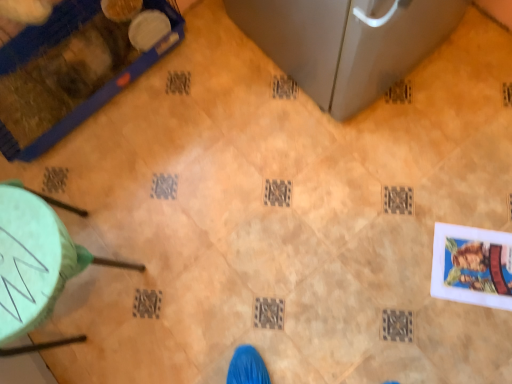
This screenshot has height=384, width=512. Find the location of `green plastic stool at lower left, the 2th furniture in the top-to-bottom sequence`. green plastic stool at lower left, the 2th furniture in the top-to-bottom sequence is located at coordinates (35, 260).

This screenshot has height=384, width=512. What do you see at coordinates (35, 260) in the screenshot?
I see `green plastic stool at lower left, placed as the first furniture when sorted from bottom to top` at bounding box center [35, 260].

What is the approximate height of green plastic stool at lower left, placed as the first furniture when sorted from bottom to top?

green plastic stool at lower left, placed as the first furniture when sorted from bottom to top, is 17.77 inches tall.

Identify the location of blue plastic pet cage at upper left, which is the 2th furniture in bottom-to-top order. The image size is (512, 384). (69, 72).

Image resolution: width=512 pixels, height=384 pixels. What do you see at coordinates (69, 72) in the screenshot? I see `blue plastic pet cage at upper left, which is the 2th furniture in bottom-to-top order` at bounding box center [69, 72].

You are a GUI agent. You are given a task and a screenshot of the screen. Output one action in this format:
    pyautogui.click(x=<x>, y=<y>)
    Task: Click on the green plastic stool at lower left, placed as the first furniture when sorted from bottom to top
    
    Given the screenshot: What is the action you would take?
    pyautogui.click(x=35, y=260)

Visually, is blue plastic pet cage at upper left, which appears as the first furniture when viewed from the top, positioned to the left or to the right of green plastic stool at lower left, the 2th furniture in the top-to-bottom sequence?

blue plastic pet cage at upper left, which appears as the first furniture when viewed from the top, is to the left of green plastic stool at lower left, the 2th furniture in the top-to-bottom sequence.

Which object is closer to the camera, blue plastic pet cage at upper left, which appears as the first furniture when viewed from the top, or green plastic stool at lower left, placed as the first furniture when sorted from bottom to top?

green plastic stool at lower left, placed as the first furniture when sorted from bottom to top, is more forward.

Which point is more forward, (94, 9) or (128, 267)?

Positioned in front is point (128, 267).

From the image's perspective, is blue plastic pet cage at upper left, which appears as the first furniture when viewed from the top, below green plastic stool at lower left, the 2th furniture in the top-to-bottom sequence?

No, from the image's perspective, blue plastic pet cage at upper left, which appears as the first furniture when viewed from the top, is not beneath green plastic stool at lower left, the 2th furniture in the top-to-bottom sequence.

From a real-world perspective, who is located lower, blue plastic pet cage at upper left, which is the 2th furniture in bottom-to-top order, or green plastic stool at lower left, the 2th furniture in the top-to-bottom sequence?

blue plastic pet cage at upper left, which is the 2th furniture in bottom-to-top order, is physically lower.

From the picture: In terms of width, does blue plastic pet cage at upper left, which appears as the first furniture when viewed from the top, look wider or thinner when compared to green plastic stool at lower left, the 2th furniture in the top-to-bottom sequence?

Clearly, blue plastic pet cage at upper left, which appears as the first furniture when viewed from the top, has more width compared to green plastic stool at lower left, the 2th furniture in the top-to-bottom sequence.

Between blue plastic pet cage at upper left, which is the 2th furniture in bottom-to-top order, and green plastic stool at lower left, the 2th furniture in the top-to-bottom sequence, which one has more height?

Standing taller between the two is green plastic stool at lower left, the 2th furniture in the top-to-bottom sequence.

Based on their sizes in the image, would you say blue plastic pet cage at upper left, which appears as the first furniture when viewed from the top, is bigger or smaller than green plastic stool at lower left, the 2th furniture in the top-to-bottom sequence?

blue plastic pet cage at upper left, which appears as the first furniture when viewed from the top, is bigger than green plastic stool at lower left, the 2th furniture in the top-to-bottom sequence.

Is blue plastic pet cage at upper left, which is the 2th furniture in bottom-to-top order, not within green plastic stool at lower left, the 2th furniture in the top-to-bottom sequence?

Indeed, blue plastic pet cage at upper left, which is the 2th furniture in bottom-to-top order, is completely outside green plastic stool at lower left, the 2th furniture in the top-to-bottom sequence.

Is blue plastic pet cage at upper left, which is the 2th furniture in bottom-to-top order, not near green plastic stool at lower left, placed as the first furniture when sorted from bottom to top?

blue plastic pet cage at upper left, which is the 2th furniture in bottom-to-top order, is actually quite close to green plastic stool at lower left, placed as the first furniture when sorted from bottom to top.

Consider the image. Could you tell me if blue plastic pet cage at upper left, which is the 2th furniture in bottom-to-top order, is facing green plastic stool at lower left, the 2th furniture in the top-to-bottom sequence?

Yes, blue plastic pet cage at upper left, which is the 2th furniture in bottom-to-top order, is turned towards green plastic stool at lower left, the 2th furniture in the top-to-bottom sequence.

Identify the location of furniture below the blue plastic pet cage at upper left, which appears as the first furniture when viewed from the top (from the image's perspective). (35, 260).

Does green plastic stool at lower left, the 2th furniture in the top-to-bottom sequence, appear on the left side of blue plastic pet cage at upper left, which appears as the first furniture when viewed from the top?

In fact, green plastic stool at lower left, the 2th furniture in the top-to-bottom sequence, is to the right of blue plastic pet cage at upper left, which appears as the first furniture when viewed from the top.

Is green plastic stool at lower left, the 2th furniture in the top-to-bottom sequence, closer to the viewer compared to blue plastic pet cage at upper left, which appears as the first furniture when viewed from the top?

Yes, it is.

Does point (24, 300) come in front of point (87, 82)?

Yes, it is.

From the image's perspective, which is below, green plastic stool at lower left, the 2th furniture in the top-to-bottom sequence, or blue plastic pet cage at upper left, which appears as the first furniture when viewed from the top?

From the image's view, green plastic stool at lower left, the 2th furniture in the top-to-bottom sequence, is below.

From a real-world perspective, is green plastic stool at lower left, placed as the first furniture when sorted from bottom to top, positioned over blue plastic pet cage at upper left, which appears as the first furniture when viewed from the top, based on gravity?

Indeed, from a real-world perspective, green plastic stool at lower left, placed as the first furniture when sorted from bottom to top, stands above blue plastic pet cage at upper left, which appears as the first furniture when viewed from the top.

Can you confirm if green plastic stool at lower left, placed as the first furniture when sorted from bottom to top, is thinner than blue plastic pet cage at upper left, which is the 2th furniture in bottom-to-top order?

Yes.

Which of these two, green plastic stool at lower left, the 2th furniture in the top-to-bottom sequence, or blue plastic pet cage at upper left, which is the 2th furniture in bottom-to-top order, stands taller?

Standing taller between the two is green plastic stool at lower left, the 2th furniture in the top-to-bottom sequence.

Who is bigger, green plastic stool at lower left, placed as the first furniture when sorted from bottom to top, or blue plastic pet cage at upper left, which appears as the first furniture when viewed from the top?

With larger size is blue plastic pet cage at upper left, which appears as the first furniture when viewed from the top.

Is blue plastic pet cage at upper left, which is the 2th furniture in bottom-to-top order, inside green plastic stool at lower left, the 2th furniture in the top-to-bottom sequence?

No, blue plastic pet cage at upper left, which is the 2th furniture in bottom-to-top order, is not surrounded by green plastic stool at lower left, the 2th furniture in the top-to-bottom sequence.

Are green plastic stool at lower left, the 2th furniture in the top-to-bottom sequence, and blue plastic pet cage at upper left, which is the 2th furniture in bottom-to-top order, beside each other?

No, green plastic stool at lower left, the 2th furniture in the top-to-bottom sequence, is not making contact with blue plastic pet cage at upper left, which is the 2th furniture in bottom-to-top order.

Could you tell me if green plastic stool at lower left, the 2th furniture in the top-to-bottom sequence, is turned towards blue plastic pet cage at upper left, which appears as the first furniture when viewed from the top?

No, green plastic stool at lower left, the 2th furniture in the top-to-bottom sequence, is not turned towards blue plastic pet cage at upper left, which appears as the first furniture when viewed from the top.

Where is `furniture below the blue plastic pet cage at upper left, which is the 2th furniture in bottom-to-top order (from the image's perspective)`? This screenshot has width=512, height=384. furniture below the blue plastic pet cage at upper left, which is the 2th furniture in bottom-to-top order (from the image's perspective) is located at coordinates (35, 260).

Where is `furniture below the blue plastic pet cage at upper left, which is the 2th furniture in bottom-to-top order (from the image's perspective)`? furniture below the blue plastic pet cage at upper left, which is the 2th furniture in bottom-to-top order (from the image's perspective) is located at coordinates (35, 260).

Locate an element on the screen. furniture on the left of green plastic stool at lower left, placed as the first furniture when sorted from bottom to top is located at coordinates (69, 72).